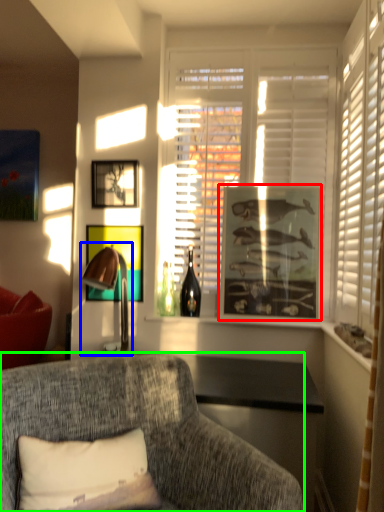
Question: Which object is positioned closest to picture frame (highlighted by a red box)? Select from table lamp (highlighted by a blue box) and studio couch (highlighted by a green box).

Choices:
 (A) table lamp
 (B) studio couch

Answer: (A)